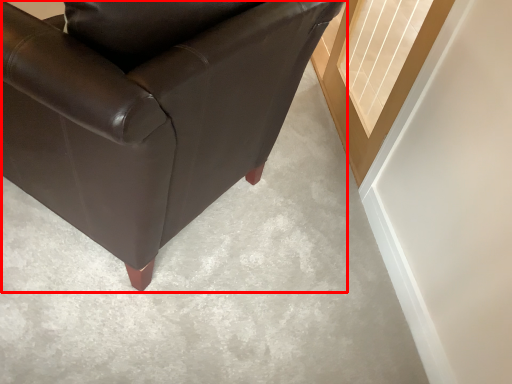
Question: Observing the image, what is the correct spatial positioning of chair (annotated by the red box) in reference to window?

Choices:
 (A) left
 (B) right

Answer: (A)